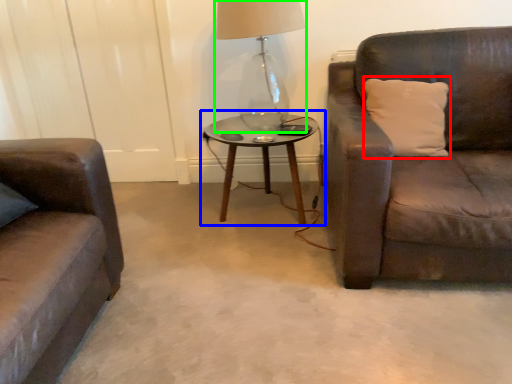
Question: Estimate the real-world distances between objects in this image. Which object is farther from pillow (highlighted by a red box), coffee table (highlighted by a blue box) or table lamp (highlighted by a green box)?

Choices:
 (A) coffee table
 (B) table lamp

Answer: (B)